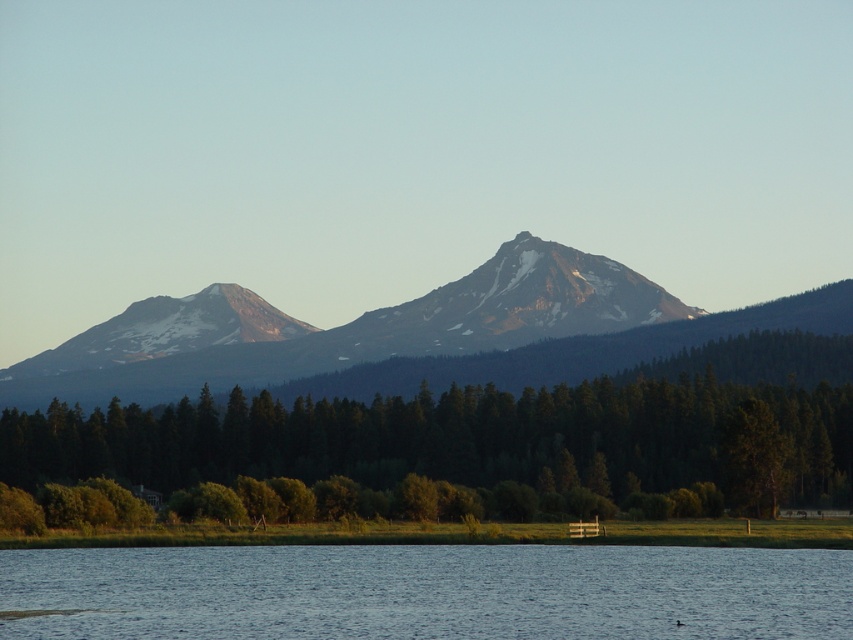
You are standing in the serene landscape and want to take a photo of both the green matte tree at center and the rocky gray mountain at center. Which object will appear larger in the photo?

The green matte tree at center will appear larger in the photo because it is closer to the viewer than the rocky gray mountain at center.

You are an environmental scientist assessing the landscape. You observe the green matte tree at center and the rocky gray mountain at center. Which object is taller from your viewpoint?

The green matte tree at center has a lesser height compared to the rocky gray mountain at center, so the rocky gray mountain at center is taller.